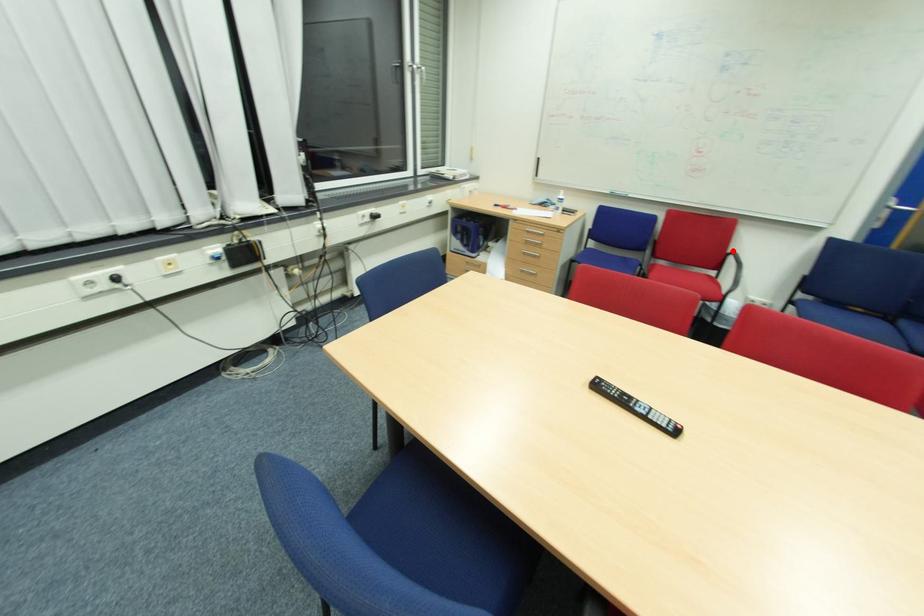
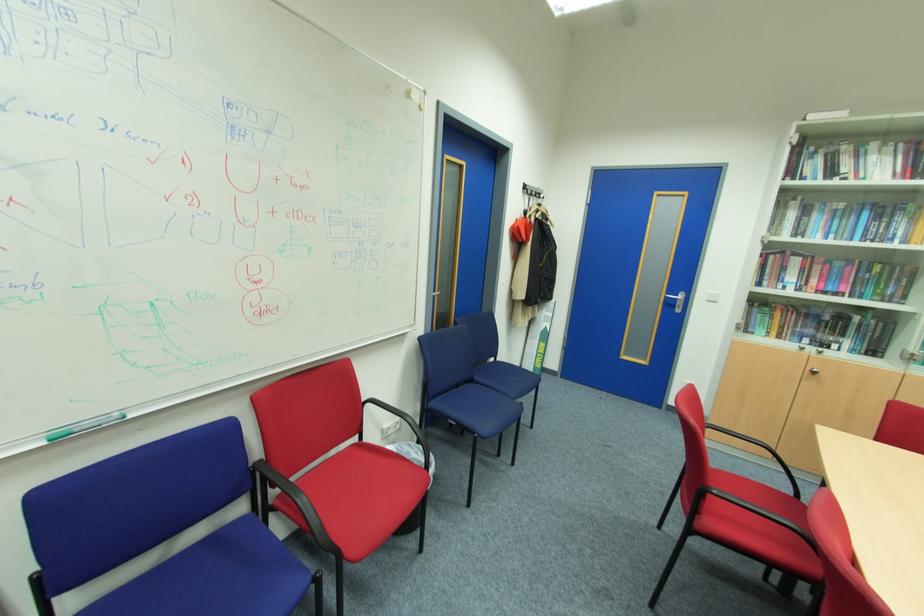
The point at the highlighted location is marked in the first image. Where is the corresponding point in the second image?

(367, 400)